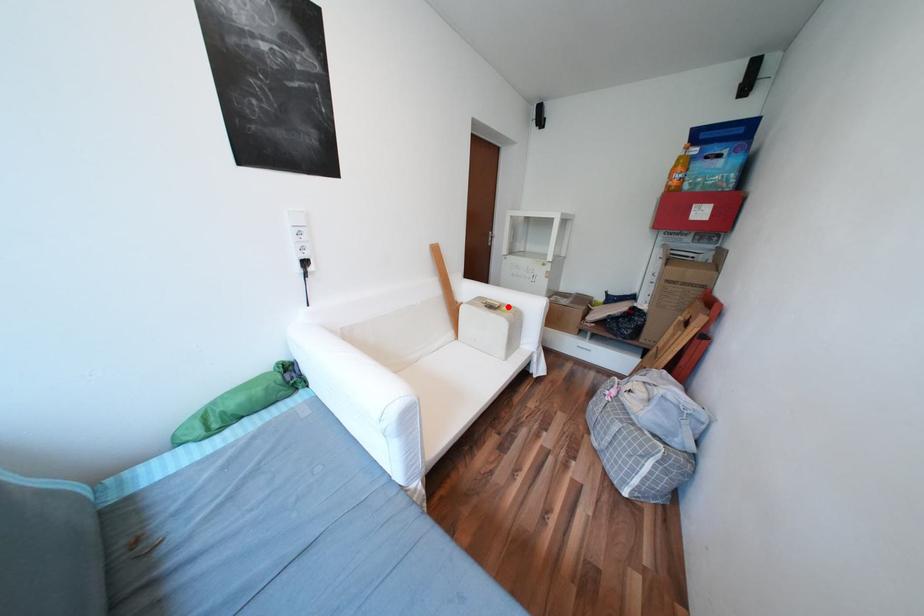
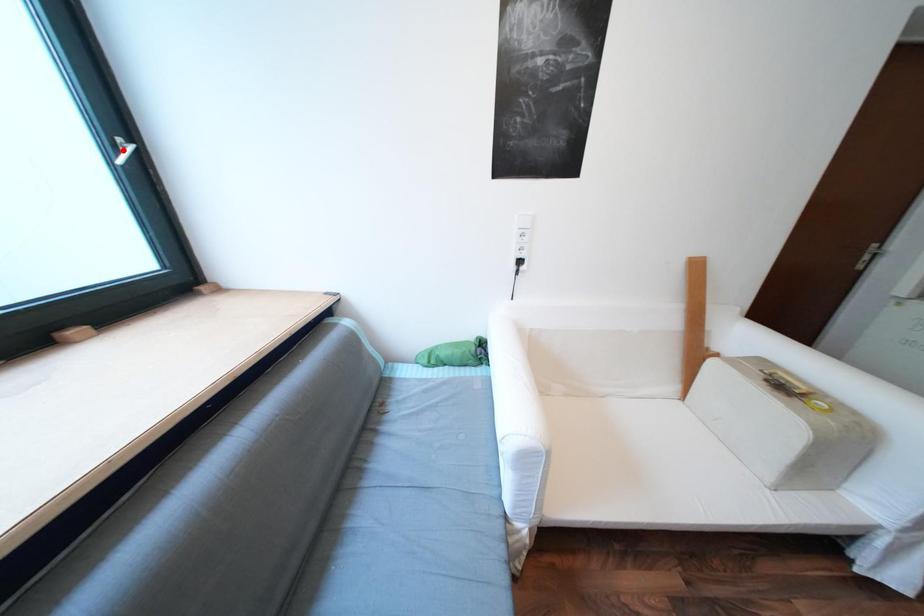
I am providing you with two images of the same scene from different viewpoints. A red point is marked on the first image and another point is marked on the second image. Are the points marked in image1 and image2 representing the same 3D position?

No